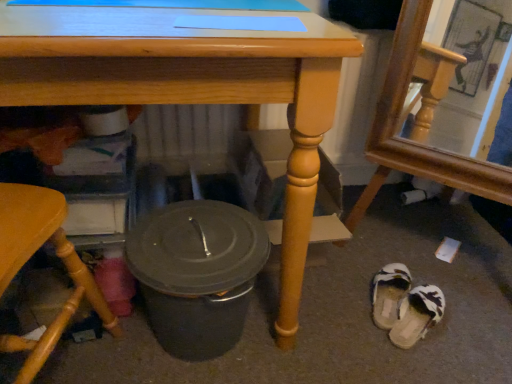
Question: Can you confirm if matte wood table at center is taller than wooden frame mirror at lower right, positioned as the first chair in right-to-left order?

Choices:
 (A) yes
 (B) no

Answer: (B)

Question: Can you confirm if matte wood table at center is thinner than wooden frame mirror at lower right, positioned as the first chair in right-to-left order?

Choices:
 (A) yes
 (B) no

Answer: (B)

Question: Is matte wood table at center shorter than wooden frame mirror at lower right, positioned as the first chair in right-to-left order?

Choices:
 (A) no
 (B) yes

Answer: (B)

Question: From a real-world perspective, is matte wood table at center located higher than wooden frame mirror at lower right, positioned as the first chair in right-to-left order?

Choices:
 (A) yes
 (B) no

Answer: (B)

Question: From a real-world perspective, is matte wood table at center below wooden frame mirror at lower right, positioned as the first chair in right-to-left order?

Choices:
 (A) yes
 (B) no

Answer: (A)

Question: Do you think matte gray crock pot at lower center is within white fuzzy slippers at lower right, arranged as the second footwear when viewed from the top, or outside of it?

Choices:
 (A) outside
 (B) inside

Answer: (A)

Question: From a real-world perspective, is matte gray crock pot at lower center positioned above or below white fuzzy slippers at lower right, marked as the 1th footwear in a bottom-to-top arrangement?

Choices:
 (A) below
 (B) above

Answer: (B)

Question: Is matte gray crock pot at lower center taller or shorter than white fuzzy slippers at lower right, marked as the 1th footwear in a bottom-to-top arrangement?

Choices:
 (A) tall
 (B) short

Answer: (A)

Question: Considering their positions, is matte gray crock pot at lower center located in front of or behind white fuzzy slippers at lower right, arranged as the second footwear when viewed from the top?

Choices:
 (A) front
 (B) behind

Answer: (A)

Question: Looking at their shapes, would you say white fabric slipper at lower right, which is counted as the second footwear, starting from the bottom, is wider or thinner than white fuzzy slippers at lower right, marked as the 1th footwear in a bottom-to-top arrangement?

Choices:
 (A) wide
 (B) thin

Answer: (B)

Question: Considering the positions of white fabric slipper at lower right, which is counted as the second footwear, starting from the bottom, and white fuzzy slippers at lower right, marked as the 1th footwear in a bottom-to-top arrangement, in the image, is white fabric slipper at lower right, which is counted as the second footwear, starting from the bottom, bigger or smaller than white fuzzy slippers at lower right, marked as the 1th footwear in a bottom-to-top arrangement,?

Choices:
 (A) big
 (B) small

Answer: (A)

Question: Considering the positions of white fabric slipper at lower right, which is the first footwear in top-to-bottom order, and white fuzzy slippers at lower right, marked as the 1th footwear in a bottom-to-top arrangement, in the image, is white fabric slipper at lower right, which is the first footwear in top-to-bottom order, taller or shorter than white fuzzy slippers at lower right, marked as the 1th footwear in a bottom-to-top arrangement,?

Choices:
 (A) short
 (B) tall

Answer: (B)

Question: Is white fabric slipper at lower right, which is counted as the second footwear, starting from the bottom, to the left or to the right of white fuzzy slippers at lower right, arranged as the second footwear when viewed from the top, in the image?

Choices:
 (A) right
 (B) left

Answer: (B)

Question: From their relative heights in the image, would you say wooden frame mirror at lower right, positioned as the 2th chair in left-to-right order, is taller or shorter than matte gray crock pot at lower center?

Choices:
 (A) tall
 (B) short

Answer: (A)

Question: Is wooden frame mirror at lower right, positioned as the 2th chair in left-to-right order, in front of or behind matte gray crock pot at lower center in the image?

Choices:
 (A) front
 (B) behind

Answer: (A)